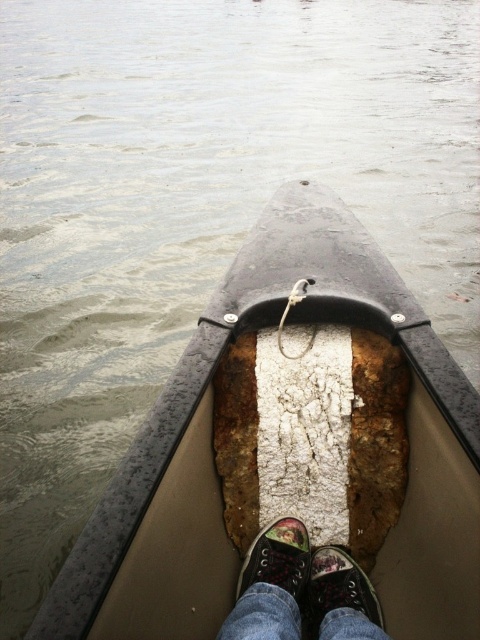
You are in a canoe and need to place a small item exactly at the point marked by coordinates point (336, 588). According to the scene description, what object is located at that point?

The point (336, 588) marks the location of the black canvas shoe at center.

Looking at this image, you are in a canoe and want to move your feet to the left side of the canoe to adjust your balance. Which shoe should you move first, the black canvas shoe at center or the multicolored canvas shoe at center?

You should move the multicolored canvas shoe at center first because the black canvas shoe at center is already to the right of it. Moving the multicolored one first will allow you to shift your weight without obstruction.